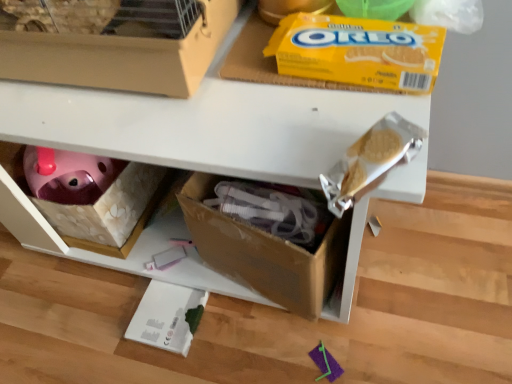
Question: Is matte cardboard box at upper left to the right of yellow cardboard oreo at upper center from the viewer's perspective?

Choices:
 (A) no
 (B) yes

Answer: (A)

Question: Is matte cardboard box at upper left looking in the opposite direction of yellow cardboard oreo at upper center?

Choices:
 (A) no
 (B) yes

Answer: (A)

Question: Is matte cardboard box at upper left far from yellow cardboard oreo at upper center?

Choices:
 (A) yes
 (B) no

Answer: (B)

Question: From the image's perspective, does matte cardboard box at upper left appear lower than yellow cardboard oreo at upper center?

Choices:
 (A) yes
 (B) no

Answer: (B)

Question: Is matte cardboard box at upper left further to the viewer compared to yellow cardboard oreo at upper center?

Choices:
 (A) yes
 (B) no

Answer: (B)

Question: Would you say yellow cardboard oreo at upper center is inside or outside cardboard box at lower center?

Choices:
 (A) outside
 (B) inside

Answer: (A)

Question: Is yellow cardboard oreo at upper center wider or thinner than cardboard box at lower center?

Choices:
 (A) wide
 (B) thin

Answer: (B)

Question: Is point (279, 69) positioned closer to the camera than point (352, 218)?

Choices:
 (A) closer
 (B) farther

Answer: (B)

Question: Considering the relative positions of yellow cardboard oreo at upper center and cardboard box at lower center in the image provided, is yellow cardboard oreo at upper center to the left or to the right of cardboard box at lower center?

Choices:
 (A) left
 (B) right

Answer: (B)

Question: In terms of width, does matte cardboard box at upper left look wider or thinner when compared to cardboard box at lower center?

Choices:
 (A) wide
 (B) thin

Answer: (B)

Question: Would you say matte cardboard box at upper left is inside or outside cardboard box at lower center?

Choices:
 (A) inside
 (B) outside

Answer: (B)

Question: From a real-world perspective, is matte cardboard box at upper left physically located above or below cardboard box at lower center?

Choices:
 (A) above
 (B) below

Answer: (A)

Question: Considering the positions of point [x=65, y=61] and point [x=33, y=107], is point [x=65, y=61] closer or farther from the camera than point [x=33, y=107]?

Choices:
 (A) farther
 (B) closer

Answer: (B)

Question: From a real-world perspective, is yellow cardboard oreo at upper center above or below matte cardboard box at upper left?

Choices:
 (A) below
 (B) above

Answer: (A)

Question: From their relative heights in the image, would you say yellow cardboard oreo at upper center is taller or shorter than matte cardboard box at upper left?

Choices:
 (A) tall
 (B) short

Answer: (B)